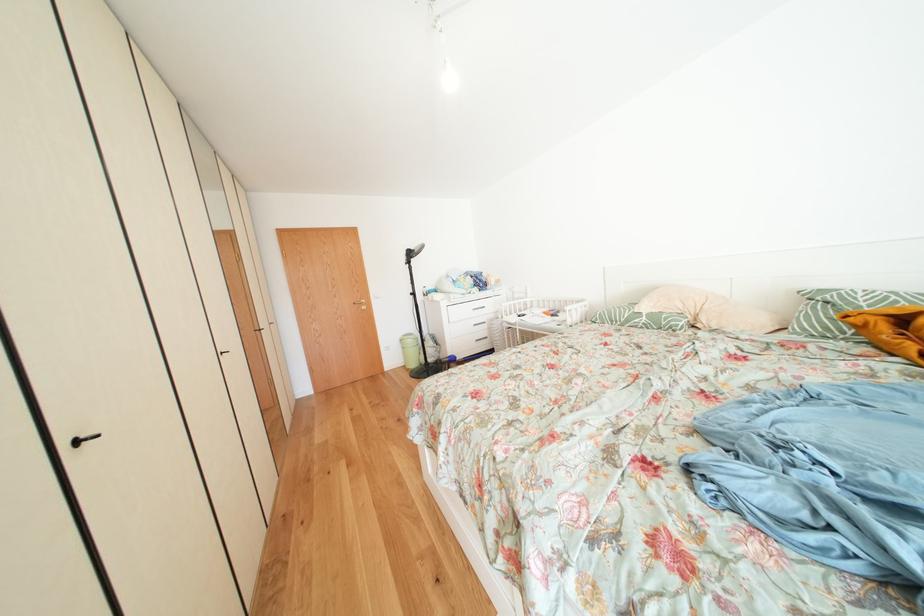
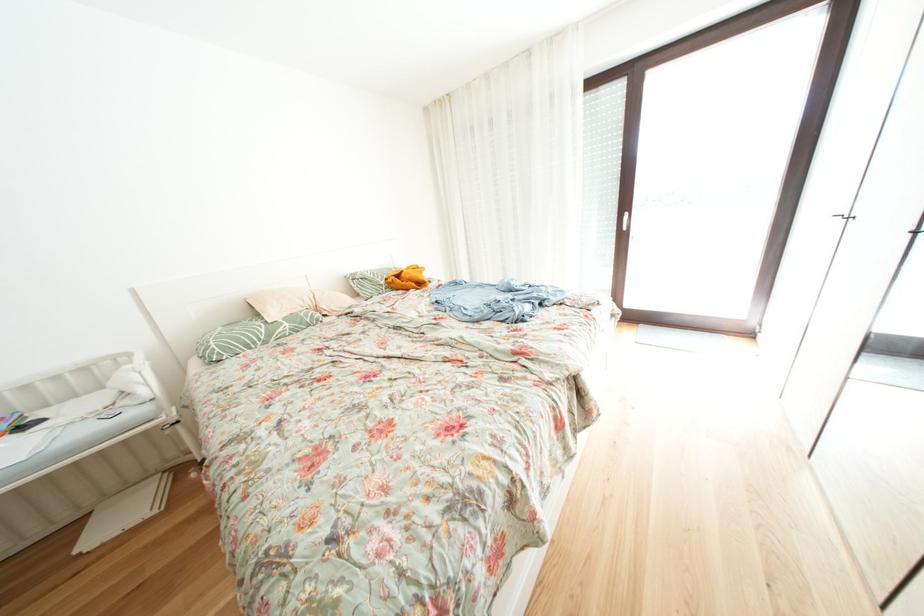
Locate, in the second image, the point that corresponds to point 653,323 in the first image.

(296, 329)